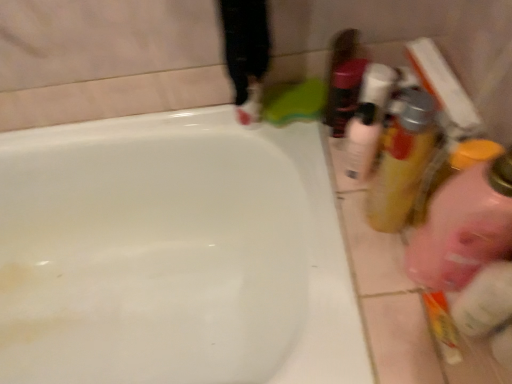
Question: From the image's perspective, is translucent plastic mouthwash at right, the 1th mouthwash when ordered from right to left, under translucent plastic bottle at upper right?

Choices:
 (A) no
 (B) yes

Answer: (B)

Question: Is translucent plastic mouthwash at right, which ranks as the second mouthwash in left-to-right order, turned away from translucent plastic bottle at upper right?

Choices:
 (A) no
 (B) yes

Answer: (A)

Question: Can you confirm if translucent plastic mouthwash at right, which ranks as the second mouthwash in left-to-right order, is bigger than translucent plastic bottle at upper right?

Choices:
 (A) no
 (B) yes

Answer: (B)

Question: Does translucent plastic mouthwash at right, the 1th mouthwash when ordered from right to left, have a lesser width compared to translucent plastic bottle at upper right?

Choices:
 (A) no
 (B) yes

Answer: (B)

Question: From the image's perspective, is translucent plastic mouthwash at right, which ranks as the second mouthwash in left-to-right order, over translucent plastic bottle at upper right?

Choices:
 (A) no
 (B) yes

Answer: (A)

Question: Is translucent plastic mouthwash at right, the 1th mouthwash when ordered from right to left, not inside translucent plastic bottle at upper right?

Choices:
 (A) no
 (B) yes

Answer: (B)

Question: Is there a large distance between translucent plastic bottle at upper right and white glossy bathtub at upper center?

Choices:
 (A) yes
 (B) no

Answer: (B)

Question: Can you confirm if translucent plastic bottle at upper right is wider than white glossy bathtub at upper center?

Choices:
 (A) no
 (B) yes

Answer: (A)

Question: Is the position of translucent plastic bottle at upper right less distant than that of white glossy bathtub at upper center?

Choices:
 (A) no
 (B) yes

Answer: (A)

Question: From the image's perspective, is translucent plastic bottle at upper right above white glossy bathtub at upper center?

Choices:
 (A) no
 (B) yes

Answer: (B)

Question: Considering the relative positions of translucent plastic bottle at upper right and white glossy bathtub at upper center in the image provided, is translucent plastic bottle at upper right to the left of white glossy bathtub at upper center from the viewer's perspective?

Choices:
 (A) yes
 (B) no

Answer: (B)

Question: Is translucent plastic bottle at upper right completely or partially outside of white glossy bathtub at upper center?

Choices:
 (A) yes
 (B) no

Answer: (A)

Question: Is translucent plastic mouthwash at right, which ranks as the second mouthwash in left-to-right order, to the right of pink translucent bottle at right from the viewer's perspective?

Choices:
 (A) no
 (B) yes

Answer: (A)